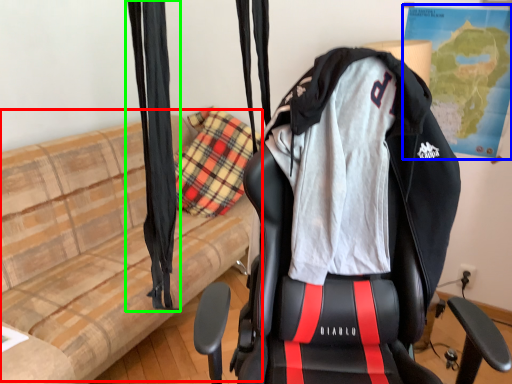
Question: Estimate the real-world distances between objects in this image. Which object is closer to couch (highlighted by a red box), map (highlighted by a blue box) or curtain (highlighted by a green box)?

Choices:
 (A) map
 (B) curtain

Answer: (B)